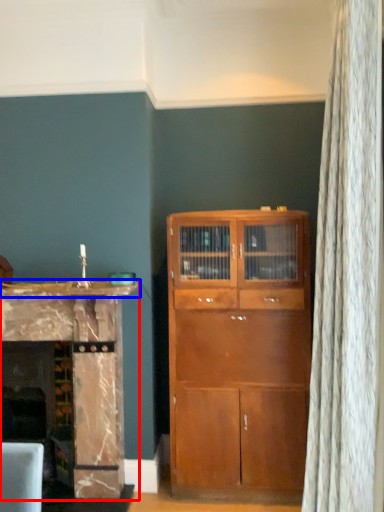
Question: Among these objects, which one is farthest to the camera, cabinetry (highlighted by a red box) or counter top (highlighted by a blue box)?

Choices:
 (A) cabinetry
 (B) counter top

Answer: (A)